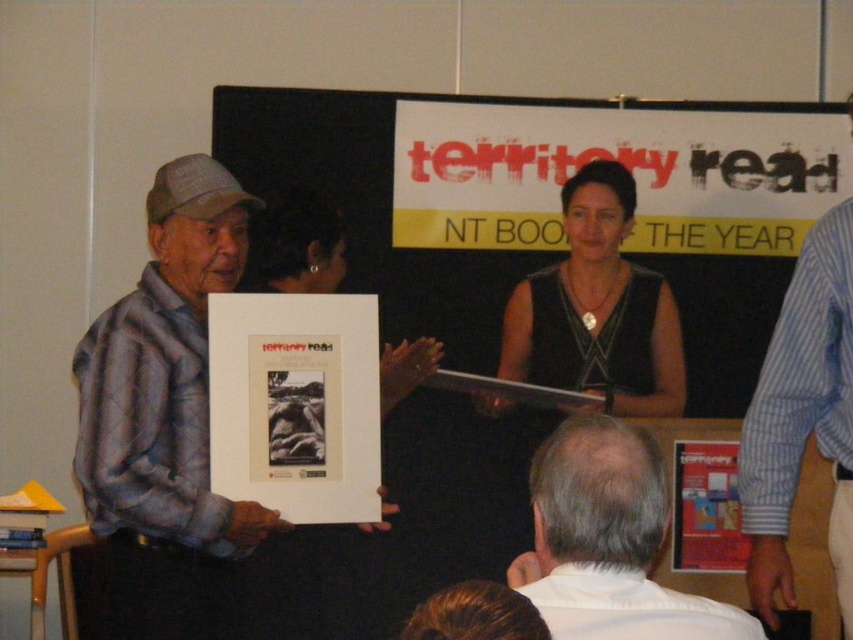
Question: Which object is closer to the camera taking this photo?

Choices:
 (A) plaid shirt at left
 (B) matte black frame at center

Answer: (A)

Question: Can you confirm if white paper at center is positioned below white matte shirt at lower center?

Choices:
 (A) yes
 (B) no

Answer: (B)

Question: Is the position of plaid shirt at left more distant than that of white matte shirt at lower center?

Choices:
 (A) no
 (B) yes

Answer: (B)

Question: Which object is farther from the camera taking this photo?

Choices:
 (A) black fabric dress at center
 (B) white matte shirt at lower center

Answer: (A)

Question: Which object is closer to the camera taking this photo?

Choices:
 (A) white paper at center
 (B) matte paper poster at center
 (C) plaid shirt at left
 (D) blue striped shirt at upper right

Answer: (D)

Question: Can you confirm if plaid shirt at left is positioned to the right of white paper at upper center?

Choices:
 (A) no
 (B) yes

Answer: (A)